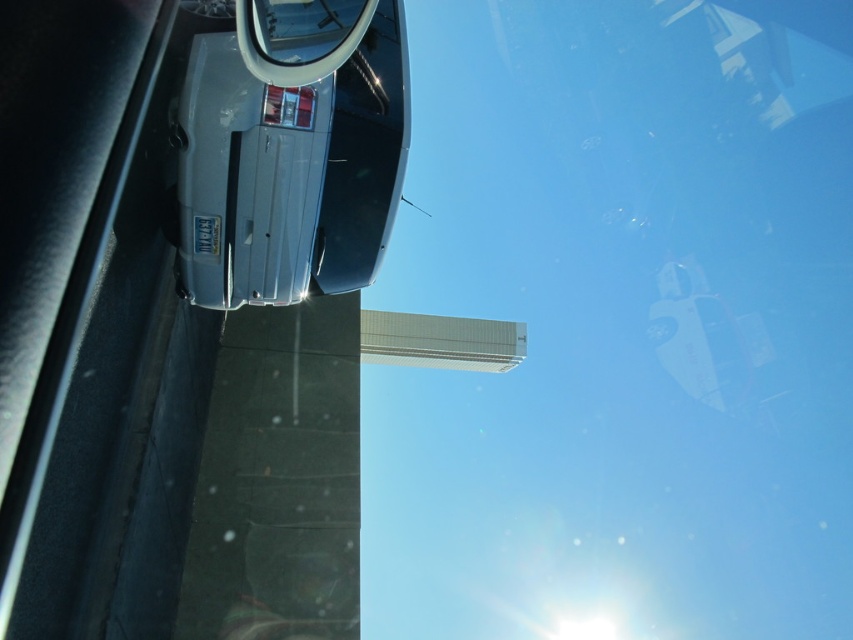
You are driving a car and want to check the distance between the satin silver car at upper left and the clear glass rearview mirror at upper center for a safety feature. Can a 25 inch sensor fit between them?

The distance between the satin silver car at upper left and the clear glass rearview mirror at upper center is 30.02 inches, so a 25 inch sensor can fit between them since it is shorter than the available space.

You are driving a car and looking through the windshield. You see two points marked on the road ahead. The first point is at coordinates point (213, 76) and the second point is at point (363, 3). Based on your current position, which point is closer to you?

Point (363, 3) is closer to you because it is in front of point (213, 76).

You are driving a car and want to change lanes. You notice the satin silver car at upper left and the clear glass rearview mirror at upper center. Which object is positioned more to the left from your perspective inside the vehicle?

The satin silver car at upper left is positioned more to the left from your perspective inside the vehicle because it is to the left of the clear glass rearview mirror at upper center.